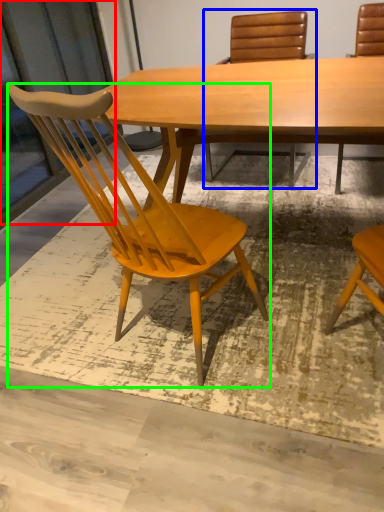
Question: Which object is the closest to the screen door (highlighted by a red box)? Choose among these: chair (highlighted by a blue box) or chair (highlighted by a green box).

Choices:
 (A) chair
 (B) chair

Answer: (A)